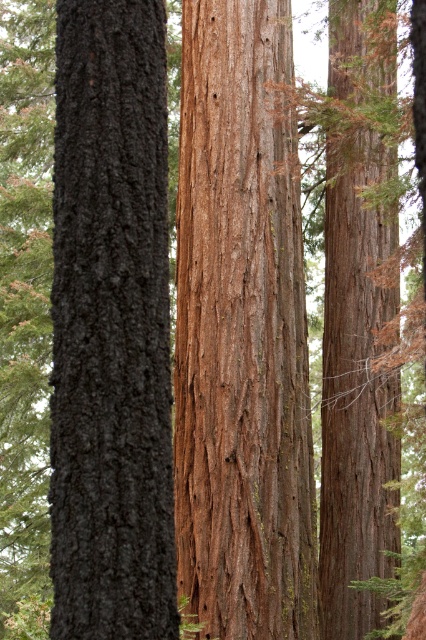
Between dark gray bark tree at left and brown rough bark tree at right, which one is positioned higher?

Positioned higher is dark gray bark tree at left.

Which of these two, dark gray bark tree at left or brown rough bark tree at right, stands shorter?

With less height is dark gray bark tree at left.

Which is in front, point (77, 596) or point (328, 211)?

Point (77, 596) is in front.

The width and height of the screenshot is (426, 640). Identify the location of dark gray bark tree at left. (111, 326).

Does brown rough bark tree at center appear on the left side of brown rough bark tree at right?

Indeed, brown rough bark tree at center is positioned on the left side of brown rough bark tree at right.

Does brown rough bark tree at center have a smaller size compared to brown rough bark tree at right?

No.

Describe the element at coordinates (241, 330) in the screenshot. I see `brown rough bark tree at center` at that location.

Where is `brown rough bark tree at center`? This screenshot has height=640, width=426. brown rough bark tree at center is located at coordinates pyautogui.click(x=241, y=330).

Is point (276, 332) less distant than point (166, 81)?

No, (276, 332) is behind (166, 81).

Is brown rough bark tree at center smaller than dark gray bark tree at left?

Actually, brown rough bark tree at center might be larger than dark gray bark tree at left.

Is point (218, 388) closer to camera compared to point (51, 381)?

No.

At what (x,y) coordinates should I click in order to perform the action: click on brown rough bark tree at center. Please return your answer as a coordinate pair (x, y). Looking at the image, I should click on (241, 330).